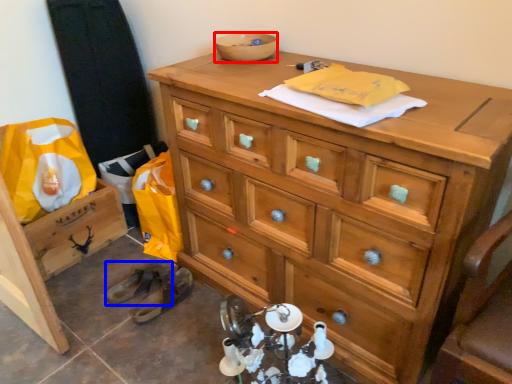
Question: Which point is further to the camera, bowl (highlighted by a red box) or shoe (highlighted by a blue box)?

Choices:
 (A) bowl
 (B) shoe

Answer: (B)